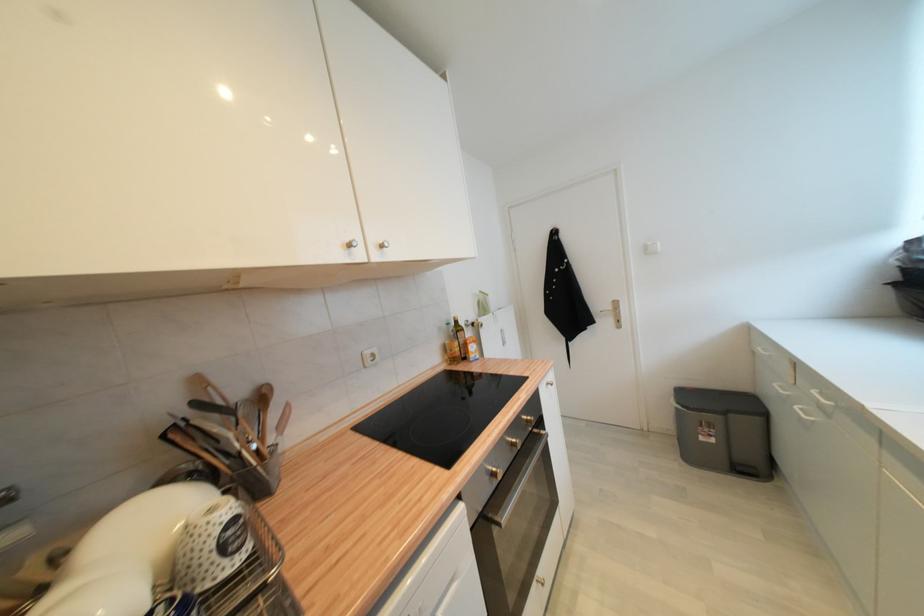
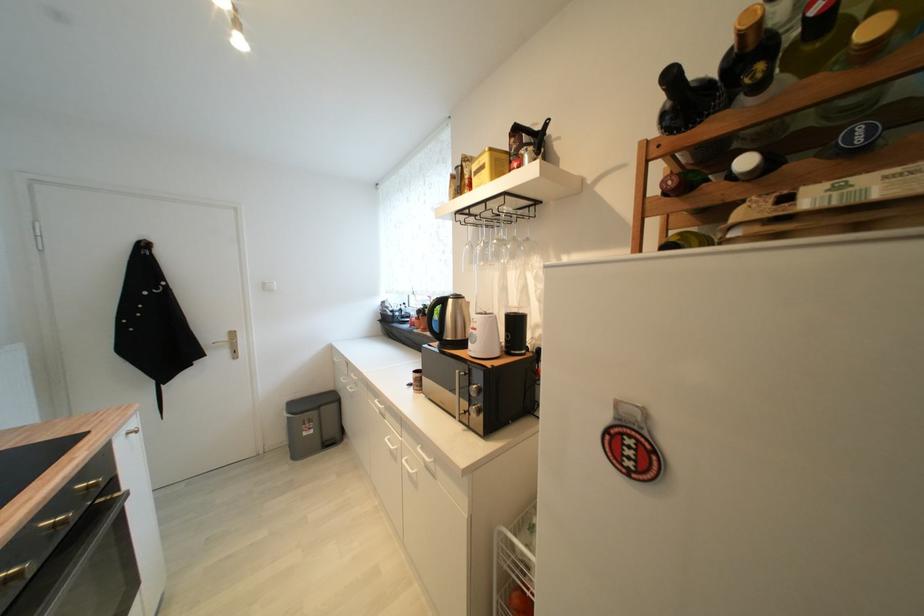
The point at (651, 253) is marked in the first image. Where is the corresponding point in the second image?

(271, 289)